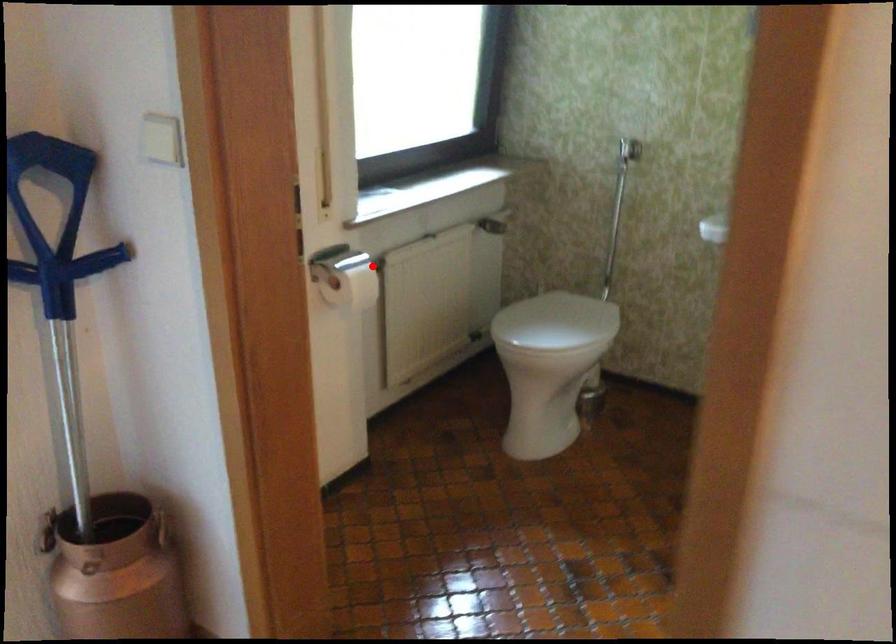
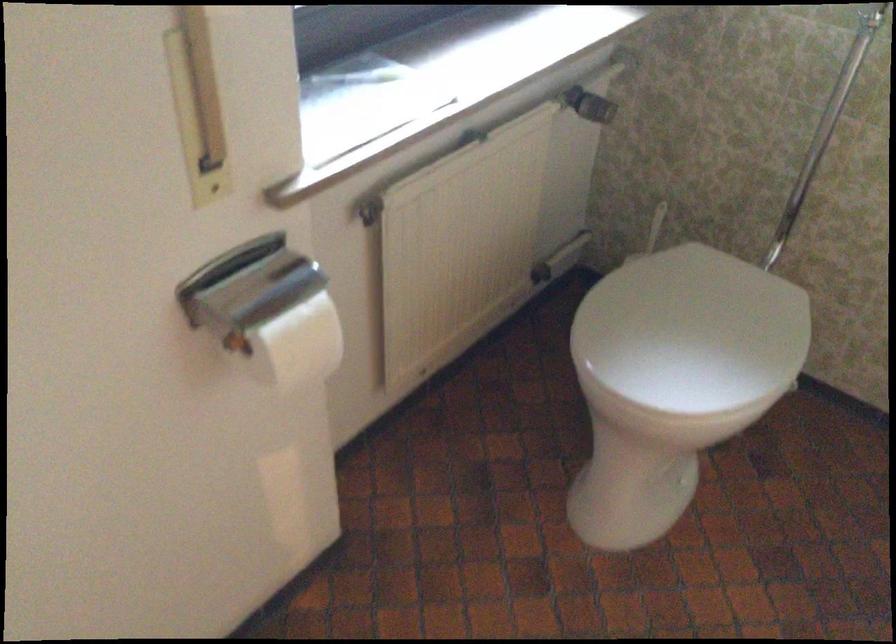
Question: I am providing you with two images of the same scene from different viewpoints. Given a red point in image1, look at the same physical point in image2. Is it:

Choices:
 (A) Closer to the viewpoint
 (B) Farther from the viewpoint

Answer: (A)